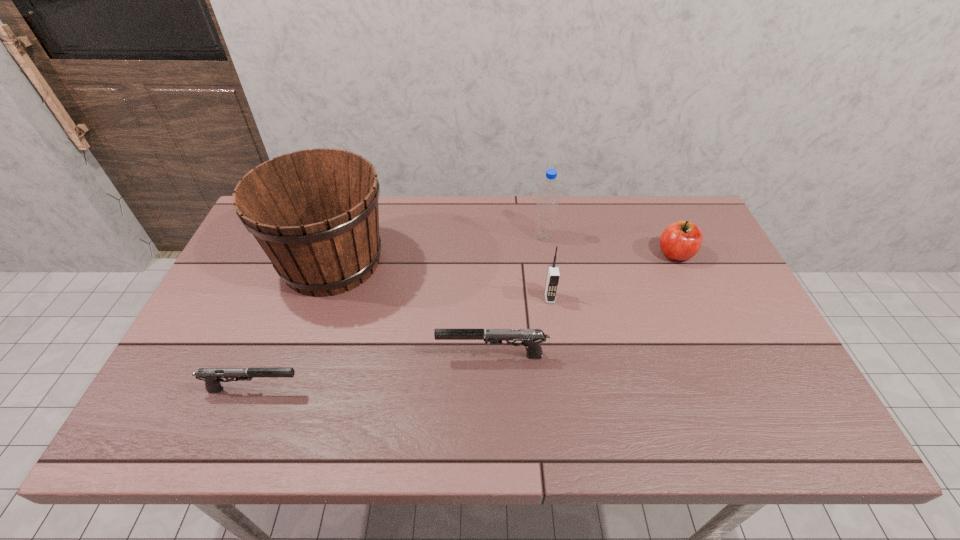
Locate an element on the screen. The height and width of the screenshot is (540, 960). vacant space located 0.120m at the muzzle end of the taller gun is located at coordinates (389, 356).

At what (x,y) coordinates should I click in order to perform the action: click on free space located 0.250m at the muzzle end of the taller gun. Please return your answer as a coordinate pair (x, y). The height and width of the screenshot is (540, 960). Looking at the image, I should click on (336, 356).

Locate an element on the screen. This screenshot has height=540, width=960. vacant point located on the back of the rightmost object is located at coordinates (656, 210).

Locate an element on the screen. The height and width of the screenshot is (540, 960). free spot located on the front of the water bottle is located at coordinates (558, 330).

Find the location of a particular element. Image resolution: width=960 pixels, height=540 pixels. vacant space positioned on the right of the wine bucket is located at coordinates (448, 261).

Locate an element on the screen. Image resolution: width=960 pixels, height=540 pixels. vacant space located on the front-facing side of the cellular telephone is located at coordinates (558, 353).

Locate an element on the screen. Image resolution: width=960 pixels, height=540 pixels. apple at the far edge is located at coordinates (680, 241).

In order to click on water bottle at the far edge in this screenshot , I will do `click(547, 203)`.

Find the location of `wine bucket that is at the far edge`. wine bucket that is at the far edge is located at coordinates (315, 214).

At what (x,y) coordinates should I click in order to perform the action: click on object positioned at the near edge. Please return your answer as a coordinate pair (x, y). Looking at the image, I should click on (212, 376).